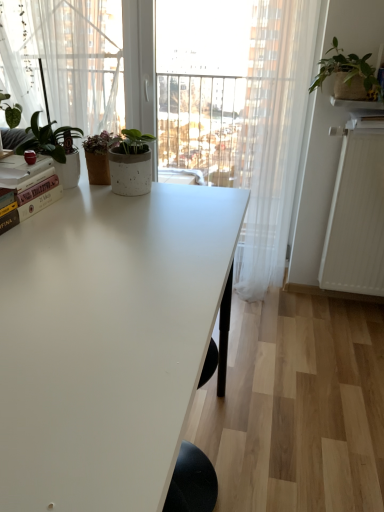
Question: From a real-world perspective, is white textured radiator at right positioned under matte white pot at upper left, the 2th houseplant positioned from the back, based on gravity?

Choices:
 (A) no
 (B) yes

Answer: (B)

Question: Is white textured radiator at right further to camera compared to matte white pot at upper left, marked as the first houseplant in a bottom-to-top arrangement?

Choices:
 (A) yes
 (B) no

Answer: (A)

Question: Is white textured radiator at right looking in the opposite direction of matte white pot at upper left, the 2th houseplant positioned from the back?

Choices:
 (A) yes
 (B) no

Answer: (B)

Question: Does white textured radiator at right touch matte white pot at upper left, which is the first houseplant in front-to-back order?

Choices:
 (A) yes
 (B) no

Answer: (B)

Question: Is white textured radiator at right to the right of matte white pot at upper left, which appears as the second houseplant when viewed from the top, from the viewer's perspective?

Choices:
 (A) yes
 (B) no

Answer: (A)

Question: In terms of width, does matte white pot at upper left, which appears as the second houseplant when viewed from the top, look wider or thinner when compared to hardcover book at left?

Choices:
 (A) thin
 (B) wide

Answer: (B)

Question: Is matte white pot at upper left, the 2th houseplant positioned from the back, spatially inside hardcover book at left, or outside of it?

Choices:
 (A) outside
 (B) inside

Answer: (A)

Question: From the image's perspective, is matte white pot at upper left, marked as the first houseplant in a bottom-to-top arrangement, positioned above or below hardcover book at left?

Choices:
 (A) above
 (B) below

Answer: (A)

Question: Based on their sizes in the image, would you say matte white pot at upper left, which is the 1th houseplant from left to right, is bigger or smaller than hardcover book at left?

Choices:
 (A) big
 (B) small

Answer: (A)

Question: Is matte white pot at upper left, the 2th houseplant positioned from the back, inside or outside of white ceramic shelf at upper right?

Choices:
 (A) outside
 (B) inside

Answer: (A)

Question: From a real-world perspective, is matte white pot at upper left, the 2th houseplant positioned from the back, physically located above or below white ceramic shelf at upper right?

Choices:
 (A) below
 (B) above

Answer: (A)

Question: Looking at their shapes, would you say matte white pot at upper left, arranged as the 2th houseplant when viewed from the right, is wider or thinner than white ceramic shelf at upper right?

Choices:
 (A) thin
 (B) wide

Answer: (B)

Question: From their relative heights in the image, would you say matte white pot at upper left, marked as the first houseplant in a bottom-to-top arrangement, is taller or shorter than white ceramic shelf at upper right?

Choices:
 (A) tall
 (B) short

Answer: (A)

Question: From the image's perspective, is white matte table at center located above or below white ceramic shelf at upper right?

Choices:
 (A) below
 (B) above

Answer: (A)

Question: Is white matte table at center to the left or to the right of white ceramic shelf at upper right in the image?

Choices:
 (A) right
 (B) left

Answer: (B)